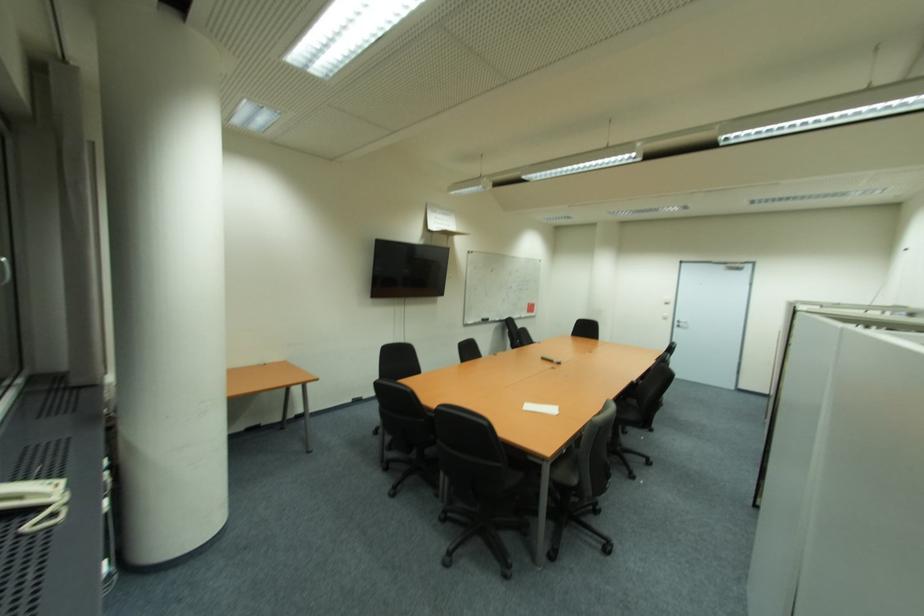
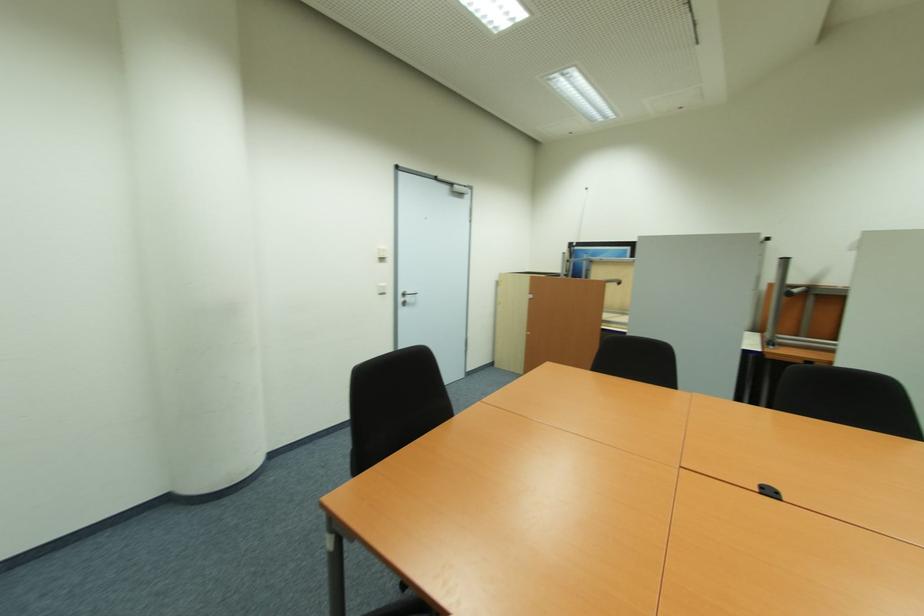
Find the pixel in the second image that matches point 681,323 in the first image.

(405, 300)